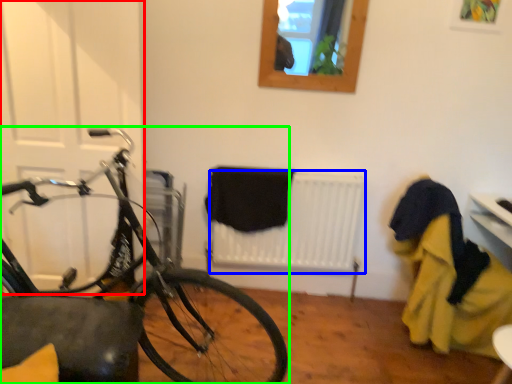
Question: Which is nearer to the door (highlighted by a red box)? radiator (highlighted by a blue box) or bicycle (highlighted by a green box).

Choices:
 (A) radiator
 (B) bicycle

Answer: (B)